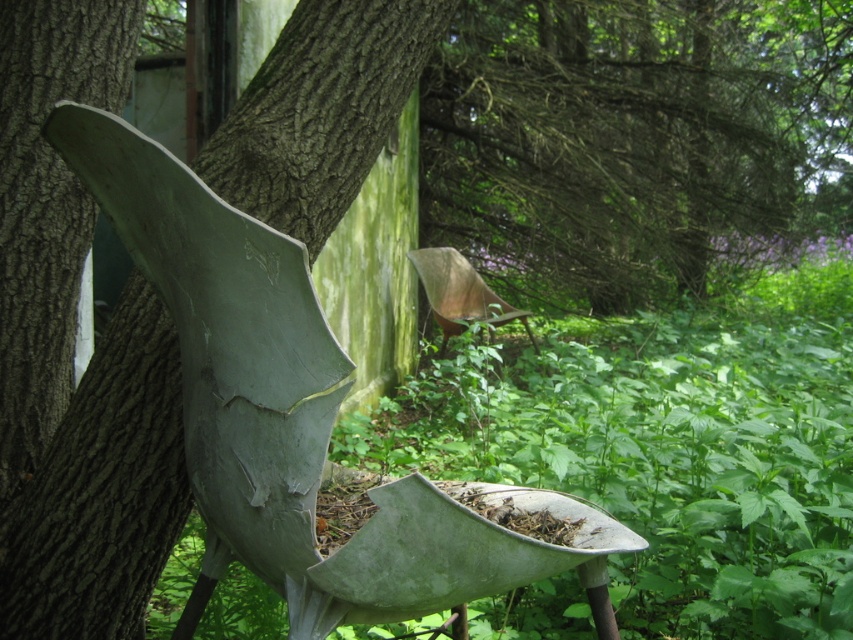
Question: Can you confirm if green rough bark tree trunk at left is smaller than matte gray bird feeder at center?

Choices:
 (A) yes
 (B) no

Answer: (A)

Question: Which object appears closest to the camera in this image?

Choices:
 (A) green rough bark tree trunk at left
 (B) matte gray bird feeder at center

Answer: (B)

Question: Is green rough bark tree trunk at left bigger than matte gray bird feeder at center?

Choices:
 (A) yes
 (B) no

Answer: (B)

Question: Is green rough bark tree trunk at left closer to camera compared to matte gray bird feeder at center?

Choices:
 (A) yes
 (B) no

Answer: (B)